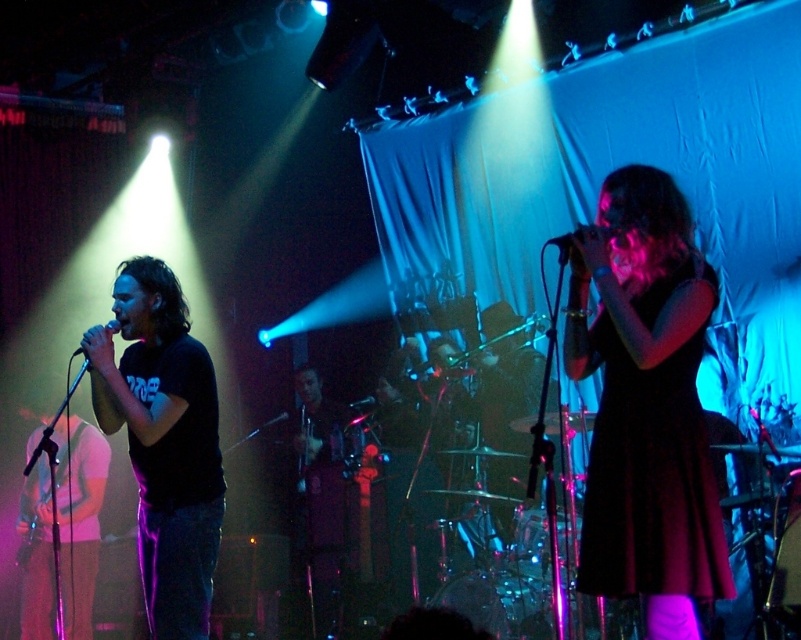
Which is in front, point (78, 596) or point (594, 228)?

Point (594, 228) is in front.

Does pink fabric shirt at left lie in front of black matte microphone at center?

No, it is behind black matte microphone at center.

Find the location of `pink fabric shirt at left`. pink fabric shirt at left is located at coordinates (79, 516).

This screenshot has height=640, width=801. I want to click on pink fabric shirt at left, so click(79, 516).

Is point (139, 396) behind point (19, 509)?

No.

Is point (200, 477) positioned in front of point (97, 460)?

Yes, it is.

Find the location of a particular element. The image size is (801, 640). matte black shirt at left is located at coordinates (163, 442).

Who is taller, matte black shirt at left or matte black microphone at left?

With more height is matte black shirt at left.

Can you confirm if matte black shirt at left is taller than matte black microphone at left?

Yes.

Between point (168, 480) and point (107, 324), which one is positioned in front?

Point (107, 324) is more forward.

Identify the location of matte black shirt at left. (163, 442).